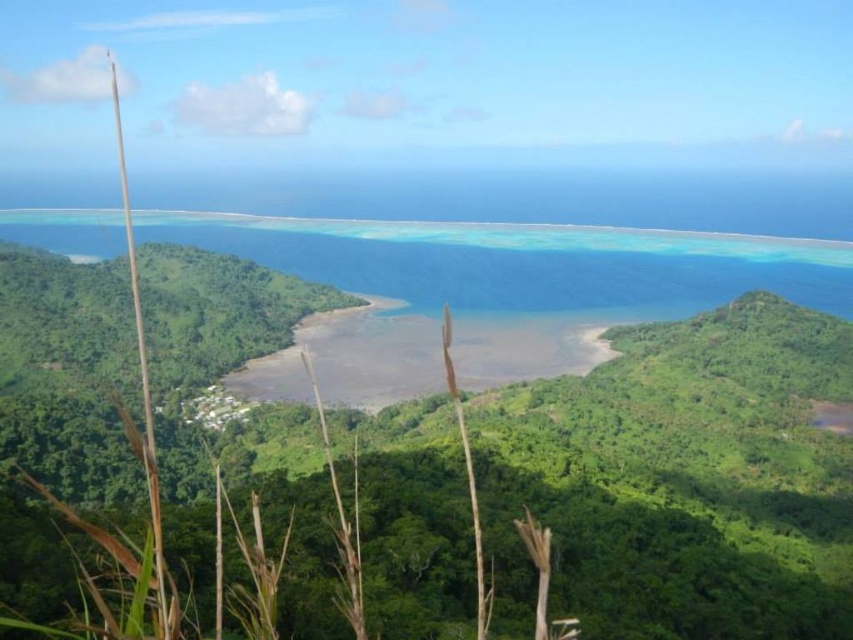
You are standing at the edge of the tropical forest and want to take a photo of both the green leafy vegetation at center and the clear blue water at center. Which object will appear larger in your photo?

The green leafy vegetation at center will appear larger in the photo because it is closer to the viewer than the clear blue water at center.

You are standing at the edge of the tropical coastal landscape and want to cross to the other side. You see green leafy vegetation at center and clear blue water at center. Which direction should you go to avoid the water?

To avoid the clear blue water at center, you should head towards the green leafy vegetation at center, which is located to the right side of the water.